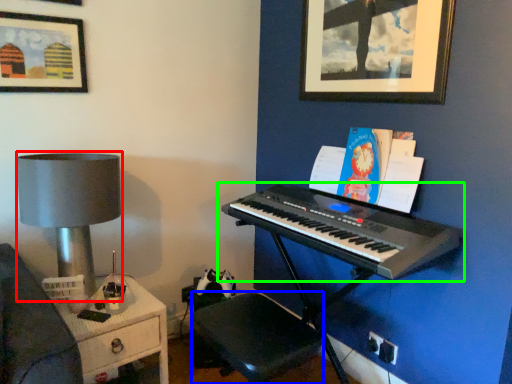
Question: Which object is positioned closest to table lamp (highlighted by a red box)? Select from music stool (highlighted by a blue box) and musical keyboard (highlighted by a green box).

Choices:
 (A) music stool
 (B) musical keyboard

Answer: (A)